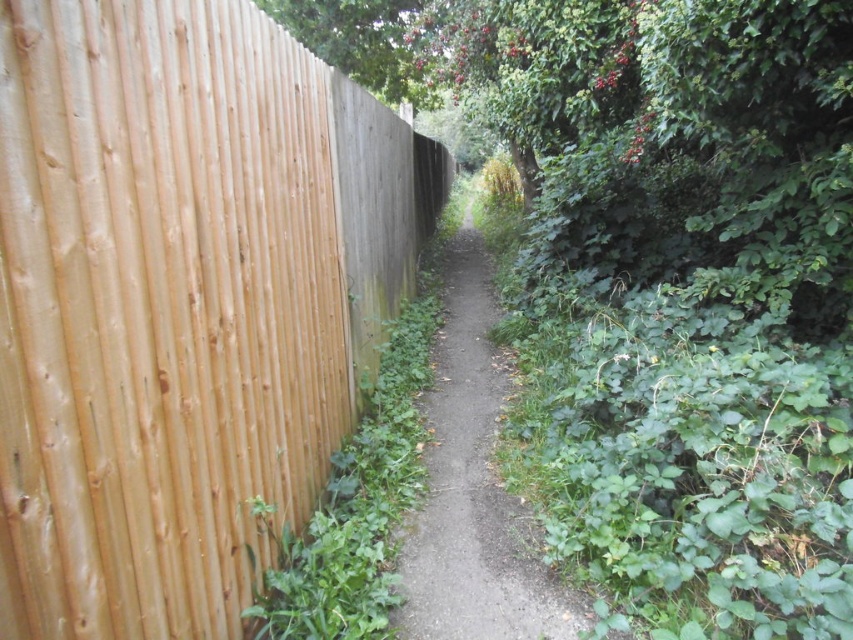
You are a hiker walking along the dirt path at center. You want to take a photo of the natural wood fence at left. Which direction should you face to capture both the fence and the path in the same frame?

The natural wood fence at left is above the dirt path at center, so you should face upward to include both the fence and the path in your photo.

You are standing at the start of the pathway and want to walk to the point marked at coordinates point (x=204, y=358) and point (x=404, y=520). Which point should you reach first?

You should reach point (x=204, y=358) first because it is closer to the camera than point (x=404, y=520).

Consider the image. You are standing at point (x=181, y=301) on the narrow pathway. To your left, there is a natural wood fence. Which direction should you walk to stay on the path and avoid the fence?

You should walk forward along the path, keeping the natural wood fence at left to your left side. Since the path curves slightly to the right, following the curve will keep you on the path and away from the fence.